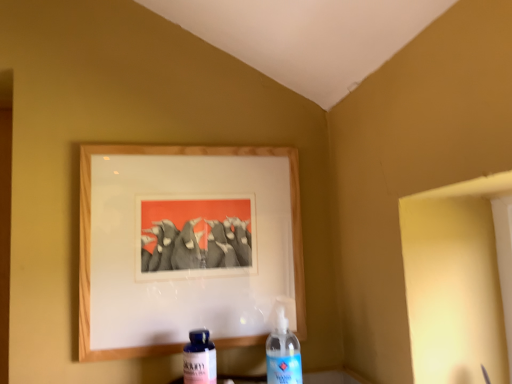
Question: Is wooden picture frame at upper center facing towards transparent plastic bottle at center, which ranks as the 2th bottle in left-to-right order?

Choices:
 (A) yes
 (B) no

Answer: (A)

Question: From a real-world perspective, does wooden picture frame at upper center stand above transparent plastic bottle at center, which is counted as the 1th bottle, starting from the right?

Choices:
 (A) no
 (B) yes

Answer: (B)

Question: Is wooden picture frame at upper center at the left side of transparent plastic bottle at center, which is counted as the 1th bottle, starting from the right?

Choices:
 (A) yes
 (B) no

Answer: (A)

Question: Considering the relative sizes of wooden picture frame at upper center and transparent plastic bottle at center, which ranks as the 2th bottle in left-to-right order, in the image provided, is wooden picture frame at upper center thinner than transparent plastic bottle at center, which ranks as the 2th bottle in left-to-right order,?

Choices:
 (A) no
 (B) yes

Answer: (B)

Question: Can you confirm if wooden picture frame at upper center is taller than transparent plastic bottle at center, which ranks as the 2th bottle in left-to-right order?

Choices:
 (A) no
 (B) yes

Answer: (B)

Question: Is point (297, 342) closer or farther from the camera than point (133, 148)?

Choices:
 (A) farther
 (B) closer

Answer: (B)

Question: In the image, is transparent plastic bottle at center, which ranks as the 2th bottle in left-to-right order, on the left side or the right side of wooden picture frame at upper center?

Choices:
 (A) left
 (B) right

Answer: (B)

Question: Is transparent plastic bottle at center, which is counted as the 1th bottle, starting from the right, inside or outside of wooden picture frame at upper center?

Choices:
 (A) outside
 (B) inside

Answer: (A)

Question: In terms of height, does transparent plastic bottle at center, which ranks as the 2th bottle in left-to-right order, look taller or shorter compared to wooden picture frame at upper center?

Choices:
 (A) tall
 (B) short

Answer: (B)

Question: Considering the positions of point (202, 329) and point (276, 332), is point (202, 329) closer or farther from the camera than point (276, 332)?

Choices:
 (A) closer
 (B) farther

Answer: (B)

Question: From a real-world perspective, is blue glass bottle at lower center, marked as the first bottle in a left-to-right arrangement, physically located above or below transparent plastic bottle at center, which ranks as the 2th bottle in left-to-right order?

Choices:
 (A) below
 (B) above

Answer: (A)

Question: Based on their sizes in the image, would you say blue glass bottle at lower center, which ranks as the 2th bottle in right-to-left order, is bigger or smaller than transparent plastic bottle at center, which is counted as the 1th bottle, starting from the right?

Choices:
 (A) small
 (B) big

Answer: (A)

Question: Relative to transparent plastic bottle at center, which ranks as the 2th bottle in left-to-right order, is blue glass bottle at lower center, marked as the first bottle in a left-to-right arrangement, in front or behind?

Choices:
 (A) front
 (B) behind

Answer: (B)

Question: Looking at their shapes, would you say blue glass bottle at lower center, which ranks as the 2th bottle in right-to-left order, is wider or thinner than wooden picture frame at upper center?

Choices:
 (A) wide
 (B) thin

Answer: (A)

Question: Would you say blue glass bottle at lower center, marked as the first bottle in a left-to-right arrangement, is inside or outside wooden picture frame at upper center?

Choices:
 (A) inside
 (B) outside

Answer: (B)